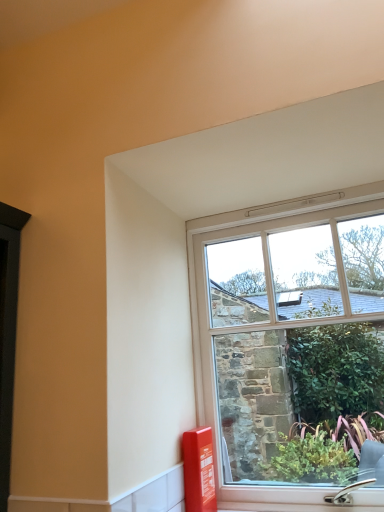
Question: Considering the relative positions of matte red fire extinguisher at lower right and clear glass window at center in the image provided, is matte red fire extinguisher at lower right to the left of clear glass window at center from the viewer's perspective?

Choices:
 (A) no
 (B) yes

Answer: (B)

Question: Does matte red fire extinguisher at lower right have a lesser width compared to clear glass window at center?

Choices:
 (A) no
 (B) yes

Answer: (A)

Question: From the image's perspective, is matte red fire extinguisher at lower right under clear glass window at center?

Choices:
 (A) yes
 (B) no

Answer: (A)

Question: Is clear glass window at center at the back of matte red fire extinguisher at lower right?

Choices:
 (A) no
 (B) yes

Answer: (B)

Question: Is matte red fire extinguisher at lower right to the right of clear glass window at center from the viewer's perspective?

Choices:
 (A) yes
 (B) no

Answer: (B)

Question: Is matte red fire extinguisher at lower right not close to clear glass window at center?

Choices:
 (A) no
 (B) yes

Answer: (A)

Question: Does clear glass window at center appear on the right side of matte red fire extinguisher at lower right?

Choices:
 (A) no
 (B) yes

Answer: (B)

Question: From a real-world perspective, is clear glass window at center located beneath matte red fire extinguisher at lower right?

Choices:
 (A) no
 (B) yes

Answer: (A)

Question: Is clear glass window at center shorter than matte red fire extinguisher at lower right?

Choices:
 (A) no
 (B) yes

Answer: (A)

Question: Is clear glass window at center outside matte red fire extinguisher at lower right?

Choices:
 (A) yes
 (B) no

Answer: (A)

Question: Considering the relative sizes of clear glass window at center and matte red fire extinguisher at lower right in the image provided, is clear glass window at center thinner than matte red fire extinguisher at lower right?

Choices:
 (A) no
 (B) yes

Answer: (B)

Question: Could you tell me if clear glass window at center is turned towards matte red fire extinguisher at lower right?

Choices:
 (A) yes
 (B) no

Answer: (A)

Question: Would you say matte red fire extinguisher at lower right is to the left or to the right of clear glass window at center in the picture?

Choices:
 (A) right
 (B) left

Answer: (B)